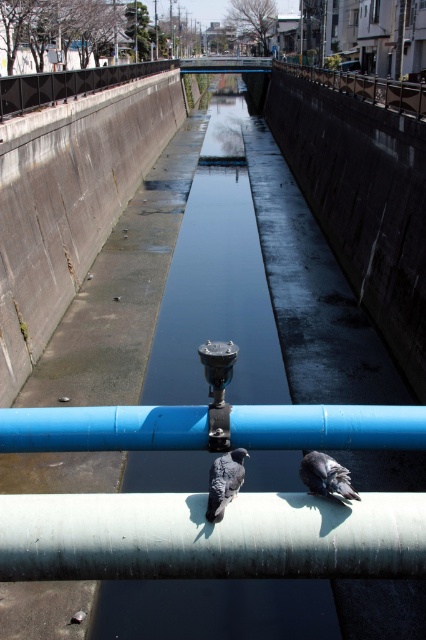
You are a photographer standing on the canal wall and want to take a photo of both point [357,93] and point [222,474]. Which point is closer to your camera lens?

Point [357,93] is closer to your camera lens because it is further to the viewer than point [222,474].

You are a bird watcher observing the canal scene. You notice the smooth metal railing at upper center and the gray speckled pigeon at center. Which object is taller in the image?

The smooth metal railing at upper center is taller than the gray speckled pigeon at center.

You are standing on the edge of the canal and want to grab the smooth metal railing at upper center. Based on its 2D location coordinates, can you estimate where you should look to find it?

The smooth metal railing at upper center is located at the 2D coordinates point (365, 88), so you should look towards the upper left area of the scene to find it.